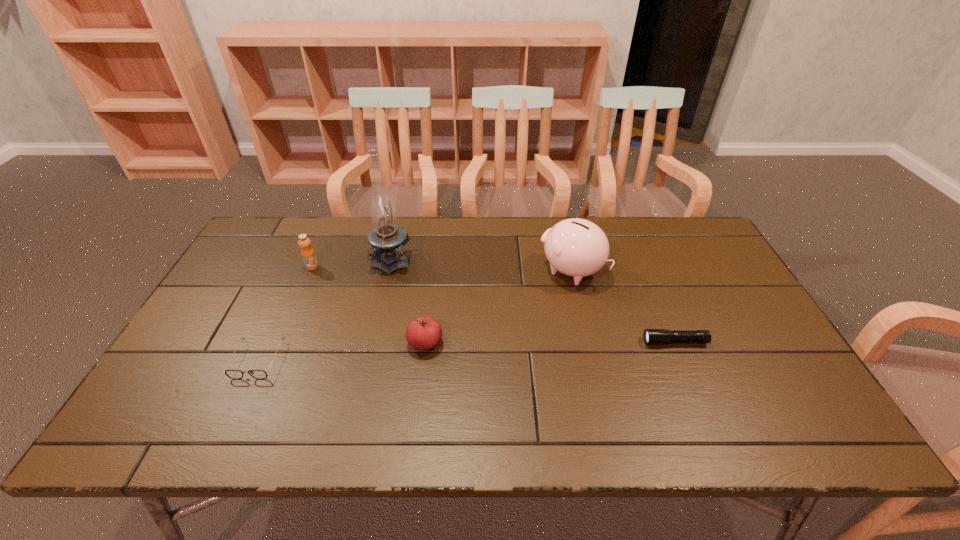
Where is `free region located 0.320m on the right of the fifth object from left to right`? The image size is (960, 540). free region located 0.320m on the right of the fifth object from left to right is located at coordinates (708, 271).

Where is `vacant space situated 0.270m on the front label of the orange juice`? This screenshot has width=960, height=540. vacant space situated 0.270m on the front label of the orange juice is located at coordinates (281, 339).

Find the location of a particular element. The width and height of the screenshot is (960, 540). free space located 0.120m on the right of the third shortest object is located at coordinates (490, 342).

Find the location of `blank space located at the lens end of the flashlight`. blank space located at the lens end of the flashlight is located at coordinates (516, 342).

Where is `vacant area situated 0.130m at the lens end of the flashlight`? This screenshot has height=540, width=960. vacant area situated 0.130m at the lens end of the flashlight is located at coordinates (594, 342).

The height and width of the screenshot is (540, 960). What are the coordinates of `vacant region located at the lens end of the flashlight` in the screenshot? It's located at (610, 342).

Where is `oil lamp located at the far edge`? Image resolution: width=960 pixels, height=540 pixels. oil lamp located at the far edge is located at coordinates (386, 238).

This screenshot has width=960, height=540. What are the coordinates of `piggy bank located at the far edge` in the screenshot? It's located at (576, 247).

Where is `object positioned at the left edge`? This screenshot has height=540, width=960. object positioned at the left edge is located at coordinates (233, 374).

Locate an element on the screen. This screenshot has width=960, height=540. vacant space at the far edge is located at coordinates (506, 242).